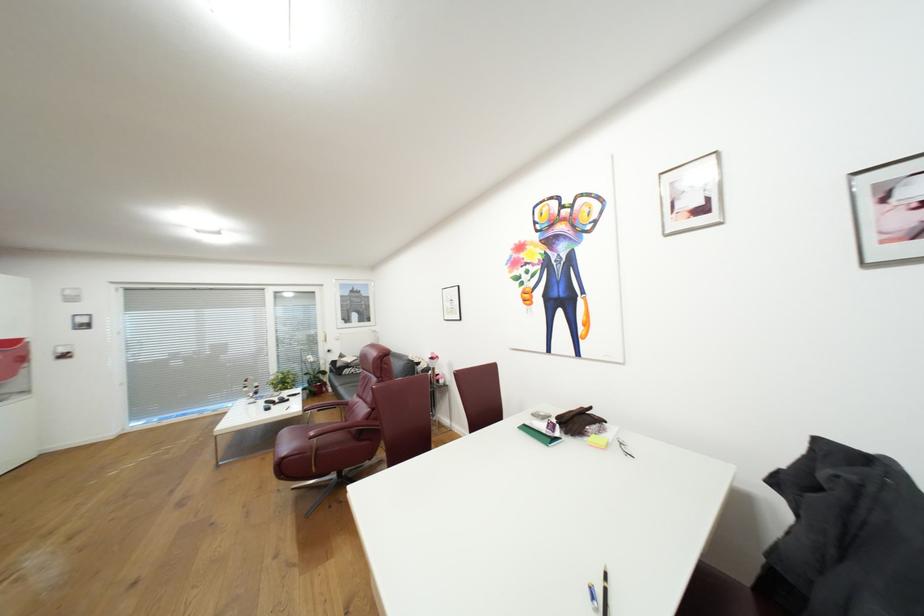
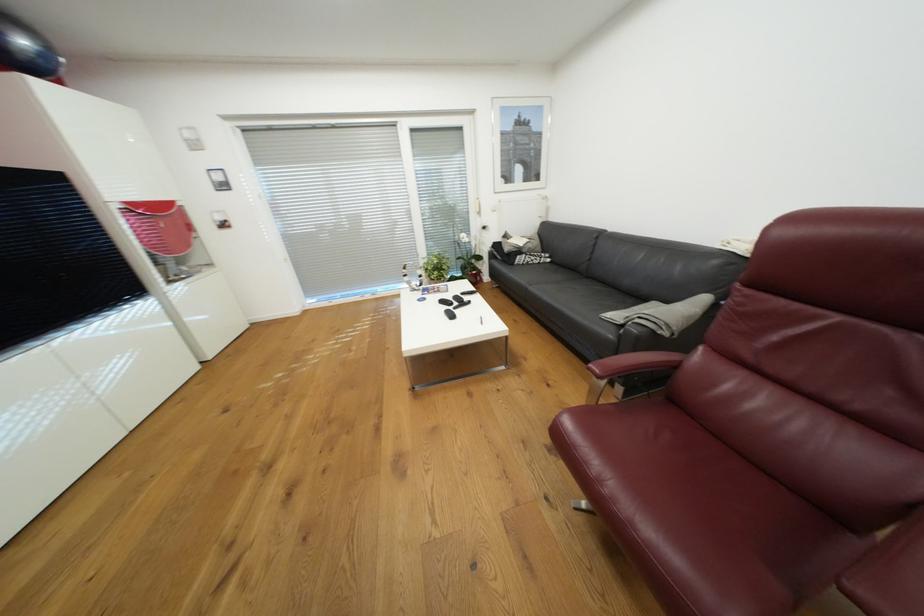
Find the pixel in the second image that matches pixel 263 392 in the first image.

(427, 284)